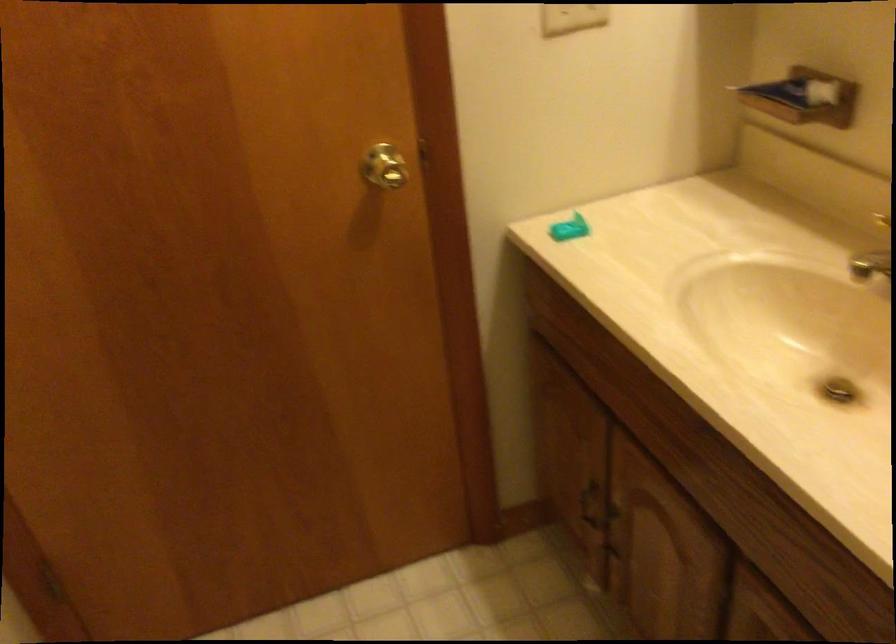
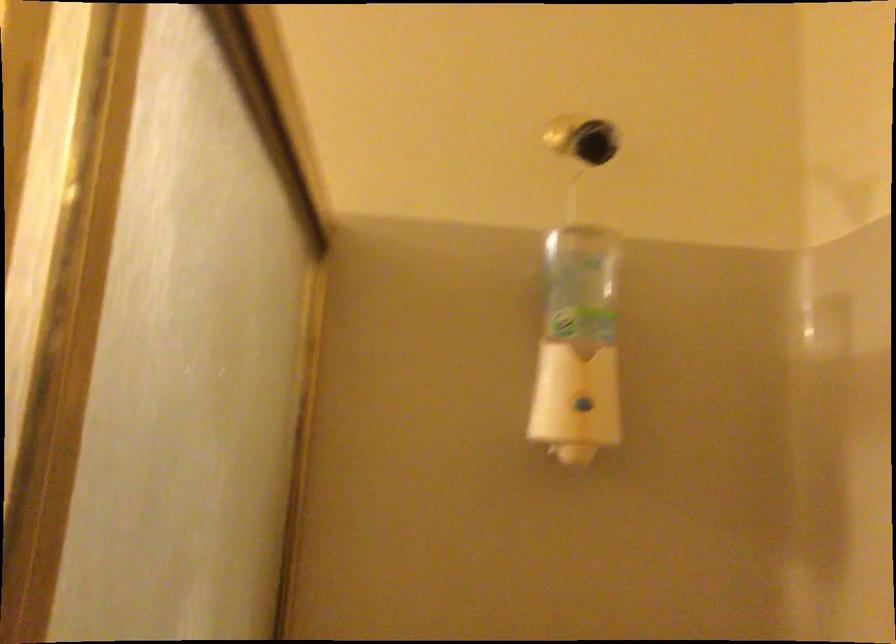
The first image is from the beginning of the video and the second image is from the end. How did the camera likely rotate when shooting the video?

The camera's rotation is toward right-up.